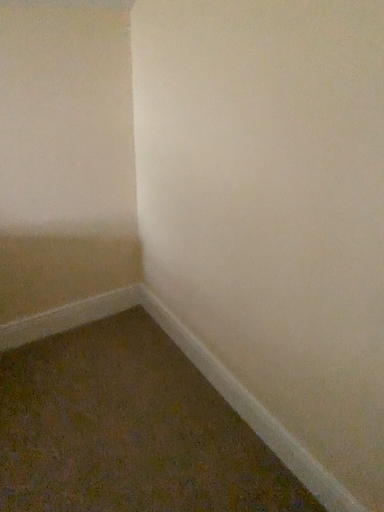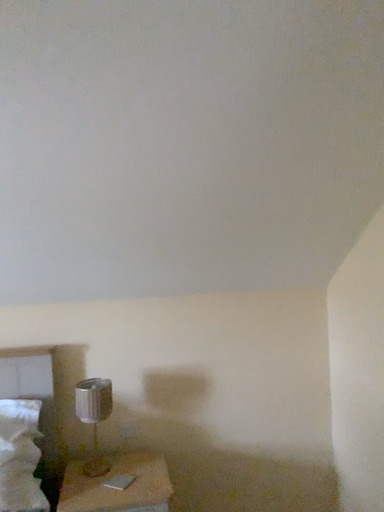
Question: How did the camera likely rotate when shooting the video?

Choices:
 (A) rotated upward
 (B) rotated downward

Answer: (A)